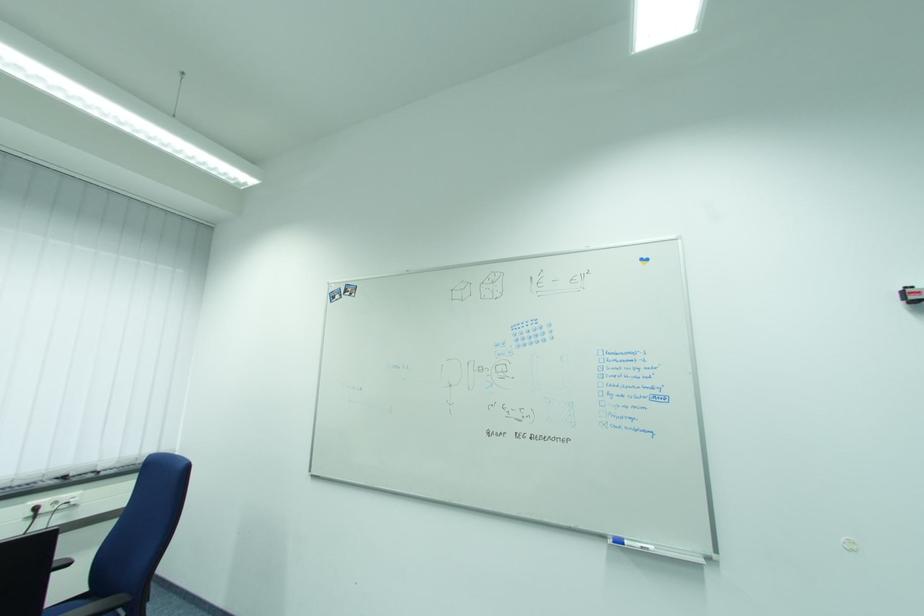
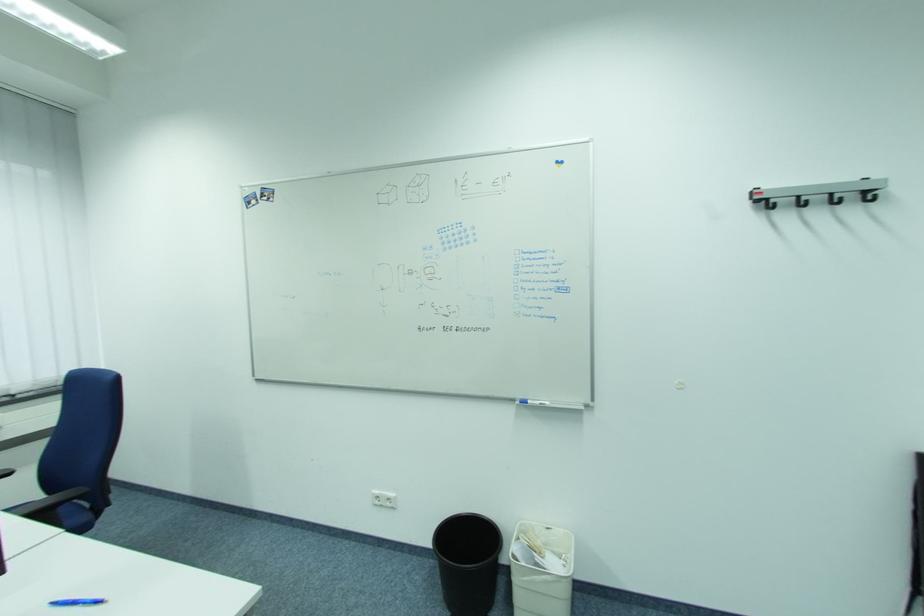
Question: Based on the continuous images, in which direction is the camera rotating? Reply with the corresponding letter.

Choices:
 (A) Left
 (B) Right
 (C) Up
 (D) Down

Answer: (D)